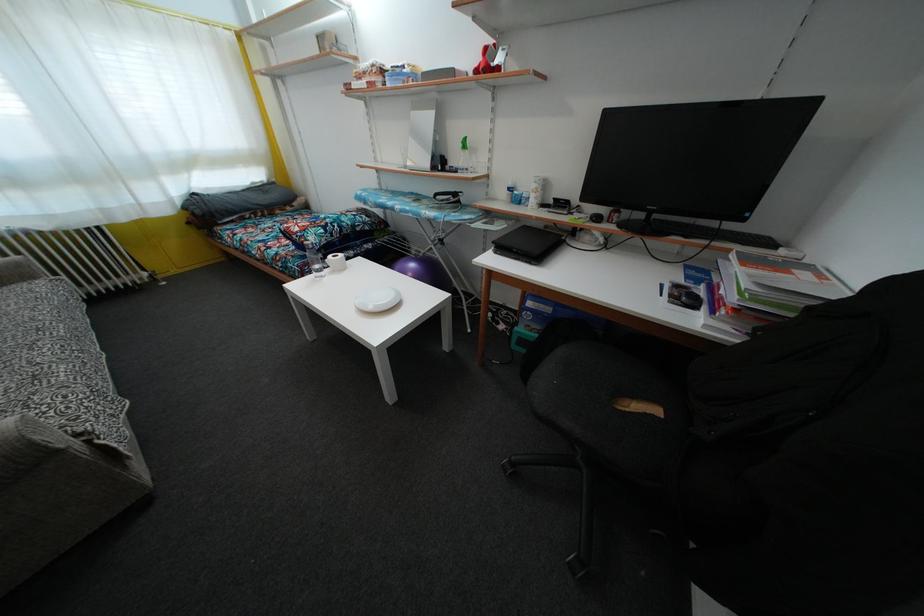
What do you see at coordinates (596, 217) in the screenshot?
I see `a black computer mouse` at bounding box center [596, 217].